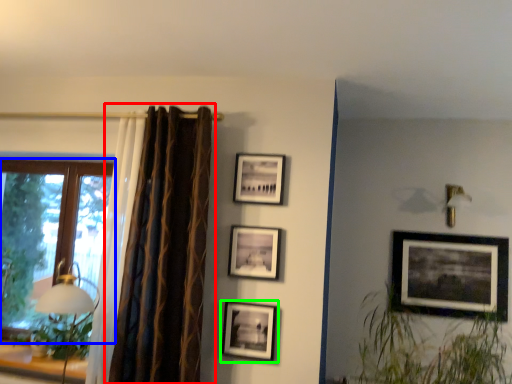
Question: Estimate the real-world distances between objects in this image. Which object is closer to curtain (highlighted by a red box), window (highlighted by a blue box) or picture frame (highlighted by a green box)?

Choices:
 (A) window
 (B) picture frame

Answer: (B)